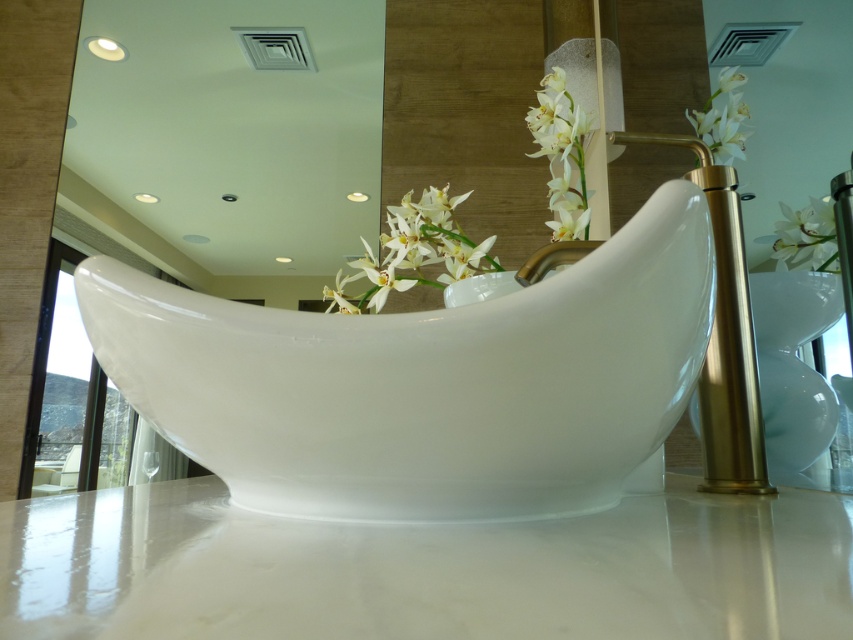
You are a florist arranging flowers in the bathroom. You have two items to place, the white porcelain flowers at upper center and the white glossy orchid at upper right. The customer wants to know if they can be placed within 10 inches of each other. Can they?

The white porcelain flowers at upper center is 8.41 inches away from the white glossy orchid at upper right, so yes, they are within the 10 inches requirement.

You are standing in the bathroom and want to reach both the white glossy bathtub at center and the white porcelain flowers at upper center. Which object will you need to walk towards first?

The white glossy bathtub at center is closer to the viewer than the white porcelain flowers at upper center, so you should walk towards the white glossy bathtub at center first before reaching the white porcelain flowers at upper center.

You are a guest in this bathroom and want to place a small vase on the marble countertop so it won not block the view of the white glossy orchid at upper right. Where should you place the vase in relation to the white glossy bathtub at center?

Place the vase behind the white glossy bathtub at center, since the bathtub is in front of the white glossy orchid at upper right, placing the vase behind the bathtub will keep it from blocking the orchid.